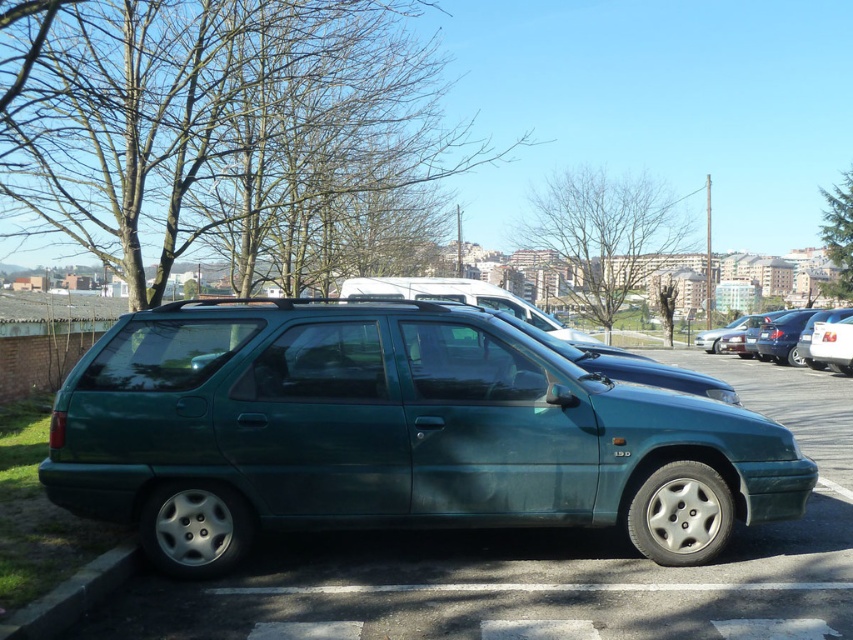
Is metallic green minivan at center positioned before white glossy van at upper center?

That is True.

Who is taller, metallic green minivan at center or white glossy van at upper center?

metallic green minivan at center is taller.

Is point (520, 333) positioned in front of point (840, 312)?

Yes, it is in front of point (840, 312).

Find the location of a particular element. The height and width of the screenshot is (640, 853). metallic green minivan at center is located at coordinates (392, 435).

Between point (665, 481) and point (805, 321), which one is positioned behind?

The point (805, 321) is behind.

Is metallic green minivan at center to the left of metallic silver sedan at center from the viewer's perspective?

Correct, you'll find metallic green minivan at center to the left of metallic silver sedan at center.

At what (x,y) coordinates should I click in order to perform the action: click on metallic green minivan at center. Please return your answer as a coordinate pair (x, y). This screenshot has width=853, height=640. Looking at the image, I should click on (392, 435).

Does metallic green minivan at center have a smaller size compared to green concrete curb at lower left?

Incorrect, metallic green minivan at center is not smaller in size than green concrete curb at lower left.

Between metallic green minivan at center and green concrete curb at lower left, which one appears on the right side from the viewer's perspective?

metallic green minivan at center is more to the right.

Where is `metallic green minivan at center`? metallic green minivan at center is located at coordinates (392, 435).